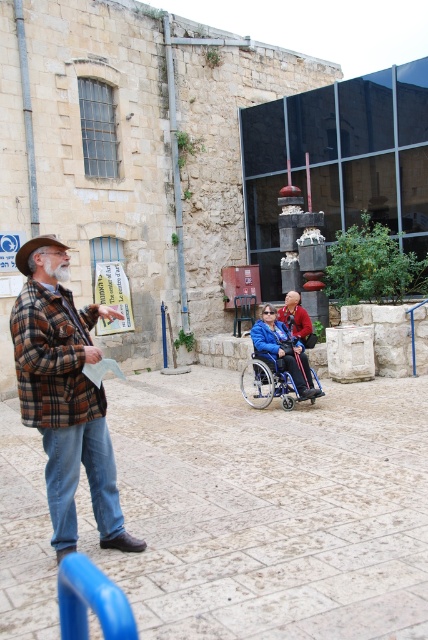
Question: Can you confirm if blue plastic wheelchair at center is thinner than red fabric jacket at center?

Choices:
 (A) yes
 (B) no

Answer: (B)

Question: Which point appears closest to the camera in this image?

Choices:
 (A) (92, 436)
 (B) (303, 376)
 (C) (311, 324)

Answer: (A)

Question: Can you confirm if plaid wool jacket at center is bigger than red fabric jacket at center?

Choices:
 (A) no
 (B) yes

Answer: (B)

Question: Which object appears closest to the camera in this image?

Choices:
 (A) plaid wool jacket at center
 (B) blue plastic wheelchair at center
 (C) red fabric jacket at center

Answer: (A)

Question: Does blue plastic wheelchair at center have a lesser width compared to red fabric jacket at center?

Choices:
 (A) yes
 (B) no

Answer: (B)

Question: Among these objects, which one is nearest to the camera?

Choices:
 (A) blue plastic wheelchair at center
 (B) plaid wool jacket at center
 (C) red fabric jacket at center

Answer: (B)